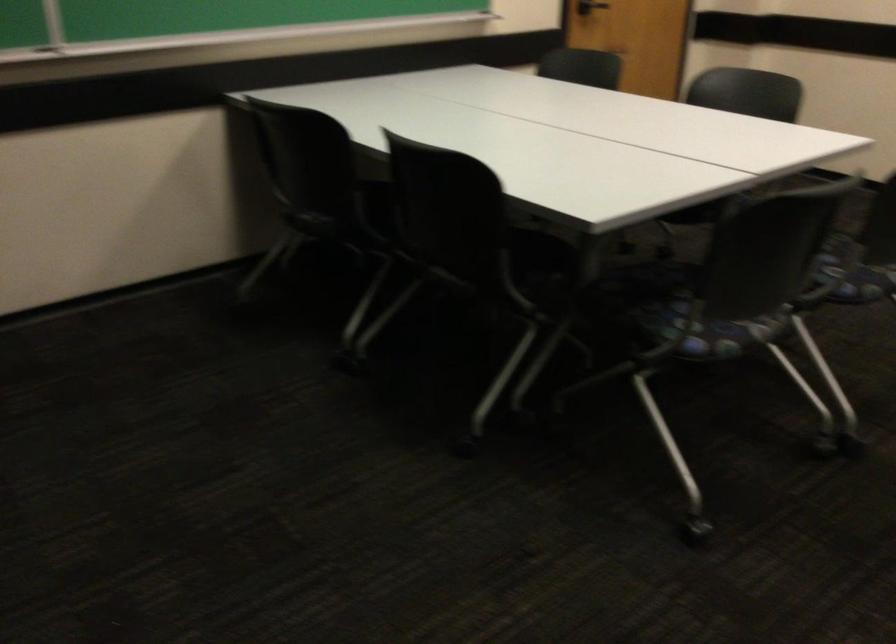
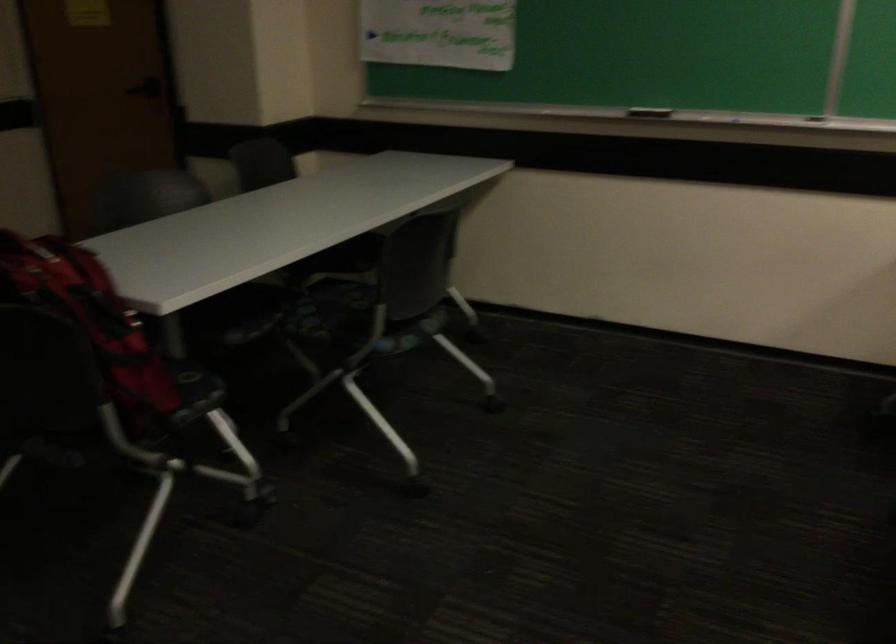
Question: The first image is from the beginning of the video and the second image is from the end. How did the camera likely rotate when shooting the video?

Choices:
 (A) Left
 (B) Right
 (C) Up
 (D) Down

Answer: (A)